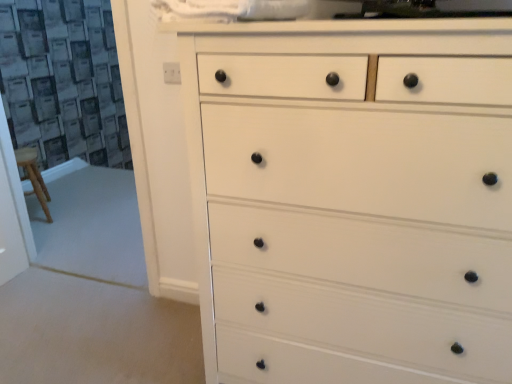
Question: Is point (168, 74) positioned closer to the camera than point (229, 331)?

Choices:
 (A) closer
 (B) farther

Answer: (B)

Question: In terms of height, does black plastic knob at upper left look taller or shorter compared to white painted wood chest of drawers at center?

Choices:
 (A) short
 (B) tall

Answer: (A)

Question: Is black plastic knob at upper left inside or outside of white painted wood chest of drawers at center?

Choices:
 (A) inside
 (B) outside

Answer: (B)

Question: Would you say white painted wood chest of drawers at center is inside or outside black plastic knob at upper left?

Choices:
 (A) inside
 (B) outside

Answer: (B)

Question: In terms of width, does white painted wood chest of drawers at center look wider or thinner when compared to black plastic knob at upper left?

Choices:
 (A) thin
 (B) wide

Answer: (B)

Question: In terms of height, does white painted wood chest of drawers at center look taller or shorter compared to black plastic knob at upper left?

Choices:
 (A) short
 (B) tall

Answer: (B)

Question: Considering their positions, is white painted wood chest of drawers at center located in front of or behind black plastic knob at upper left?

Choices:
 (A) front
 (B) behind

Answer: (A)